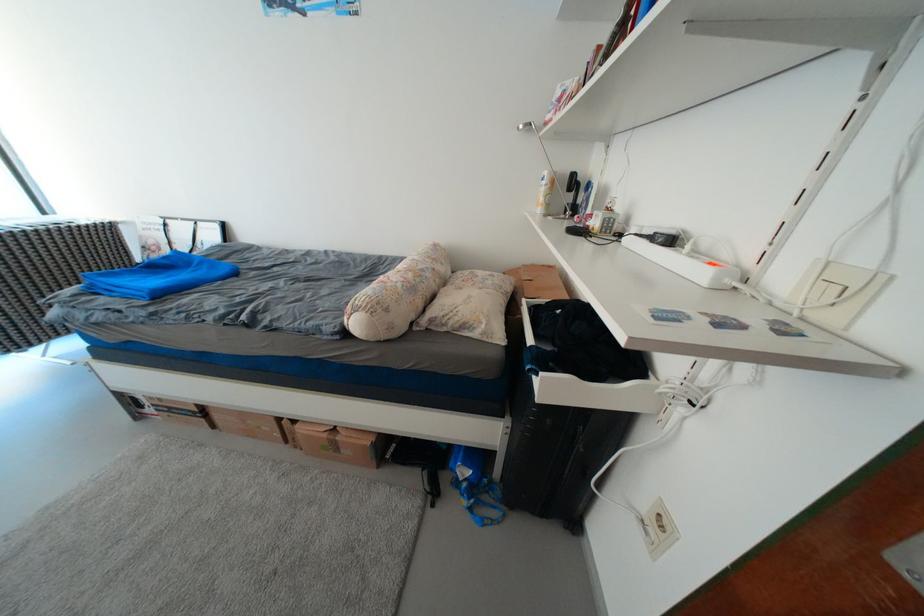
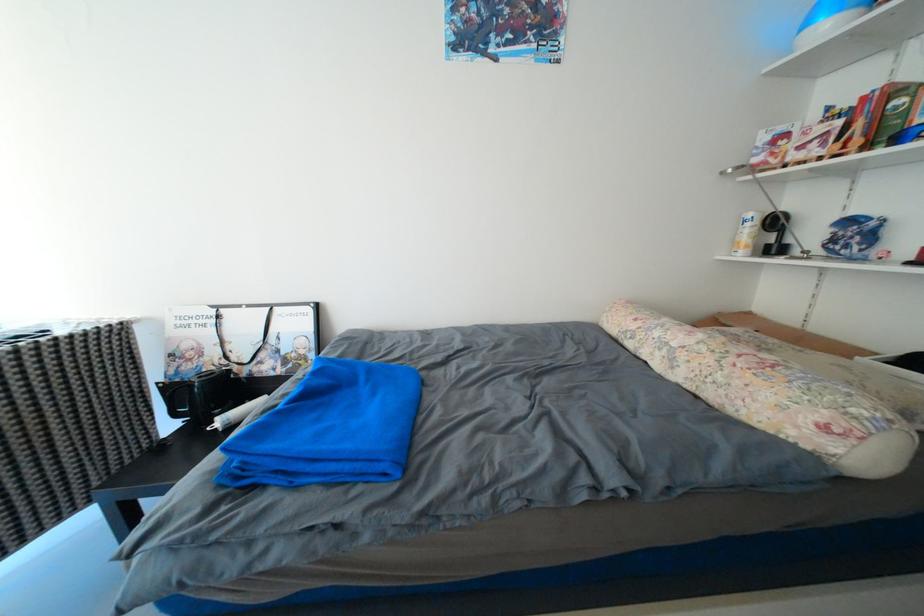
In the scene shown: What movement of the cameraman would produce the second image?

The cameraman walked toward left, forward.